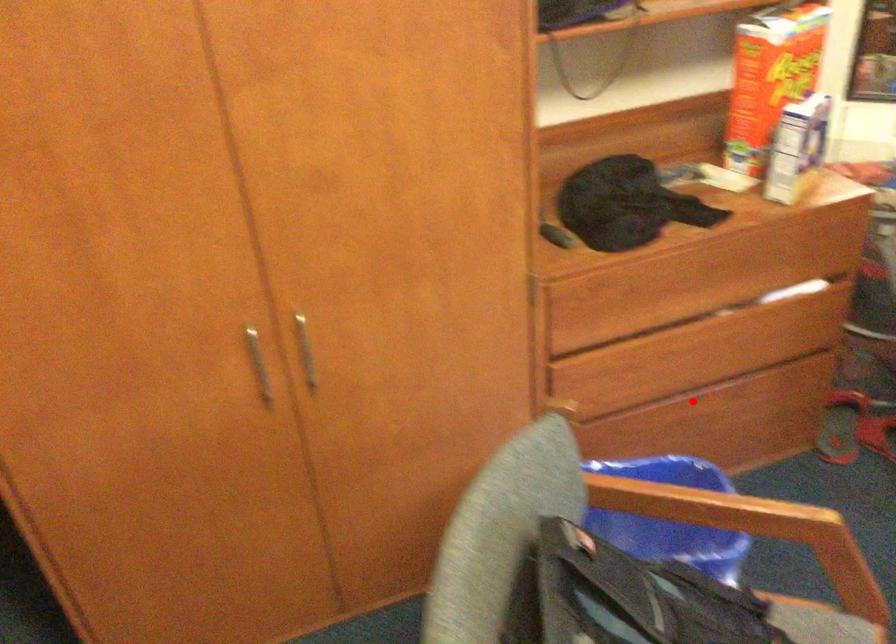
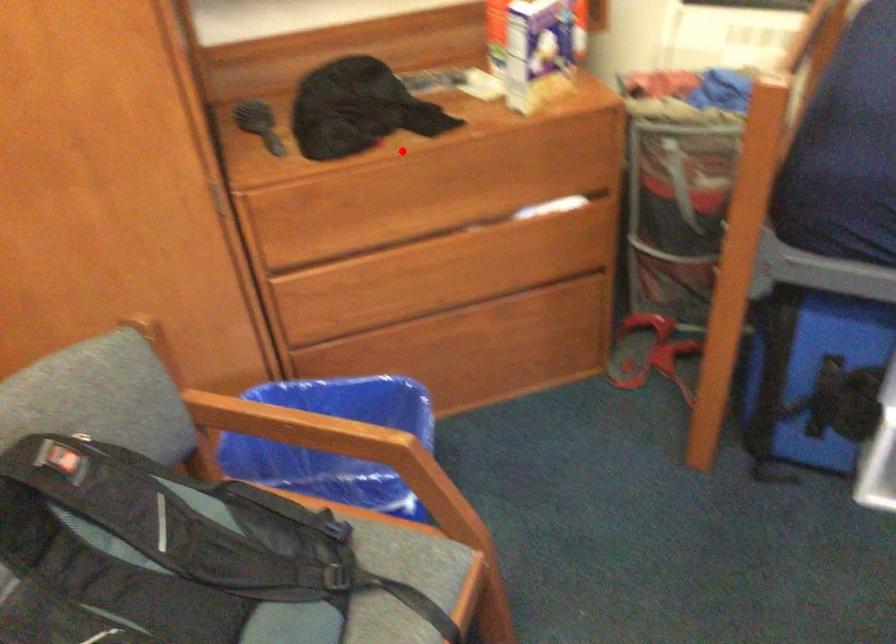
I am providing you with two images of the same scene from different viewpoints. A red point is marked on the first image and another point is marked on the second image. Do the highlighted points in image1 and image2 indicate the same real-world spot?

No